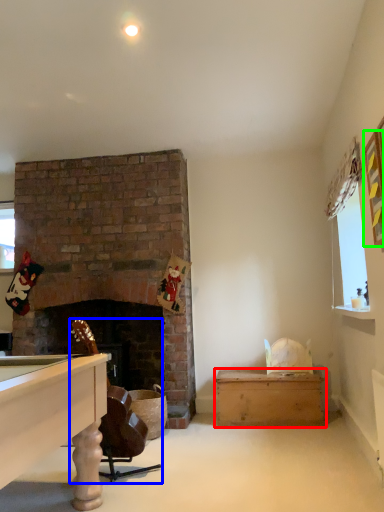
Question: Which object is positioned farthest from table (highlighted by a red box)? Select from rocking chair (highlighted by a blue box) and picture frame (highlighted by a green box).

Choices:
 (A) rocking chair
 (B) picture frame

Answer: (B)